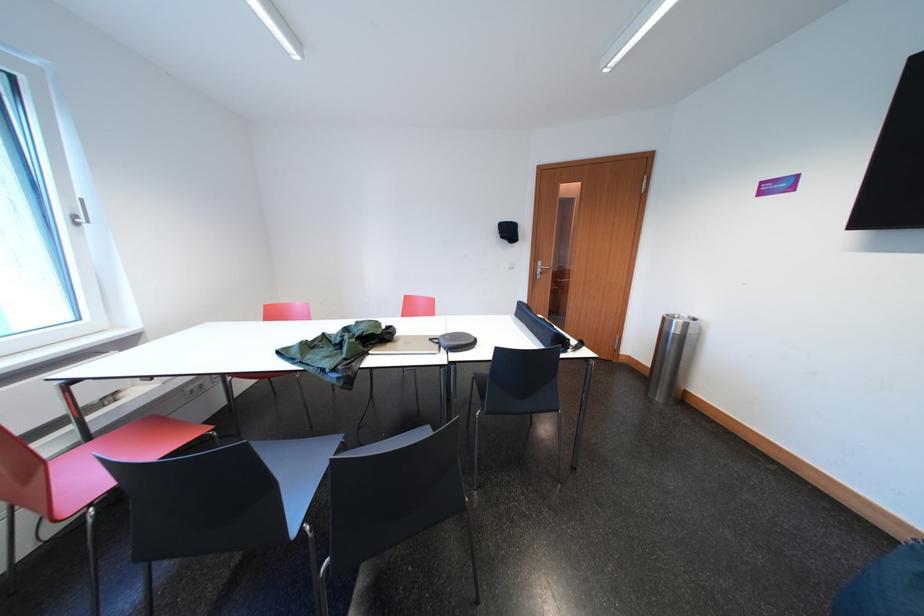
The image size is (924, 616). I want to click on silver window handle, so click(80, 214).